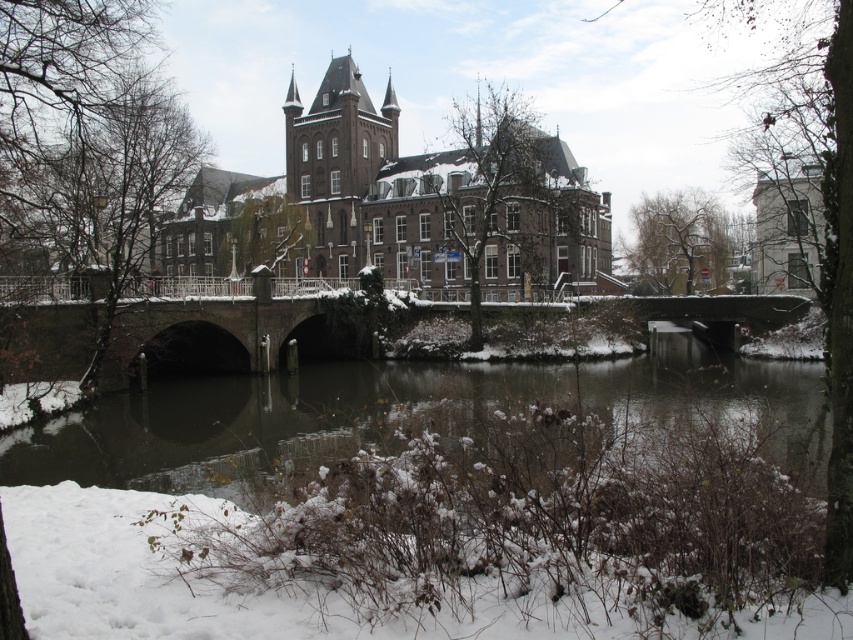
Can you confirm if snowy brown water at lower center is wider than dark brown stone tower at center?

Correct, the width of snowy brown water at lower center exceeds that of dark brown stone tower at center.

Between snowy brown water at lower center and dark brown stone tower at center, which one has more height?

Standing taller between the two is dark brown stone tower at center.

At what (x,y) coordinates should I click in order to perform the action: click on snowy brown water at lower center. Please return your answer as a coordinate pair (x, y). Image resolution: width=853 pixels, height=640 pixels. Looking at the image, I should click on (389, 417).

Is point (183, 305) positioned behind point (312, 216)?

No.

This screenshot has height=640, width=853. What do you see at coordinates (207, 324) in the screenshot?
I see `concrete stone bridge at center` at bounding box center [207, 324].

The image size is (853, 640). I want to click on concrete stone bridge at center, so click(207, 324).

Does snowy brown water at lower center have a greater height compared to concrete stone bridge at center?

No.

Who is shorter, snowy brown water at lower center or concrete stone bridge at center?

Standing shorter between the two is snowy brown water at lower center.

What are the coordinates of `snowy brown water at lower center` in the screenshot? It's located at (389, 417).